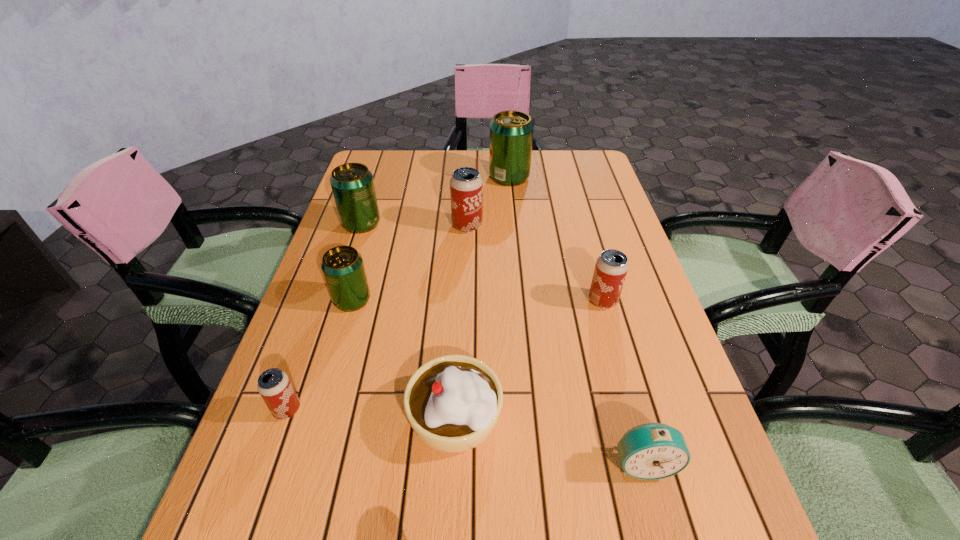
Where is `free space between the nearest green beer can and the beige whipped cream`? The width and height of the screenshot is (960, 540). free space between the nearest green beer can and the beige whipped cream is located at coordinates (403, 357).

I want to click on vacant space that is in between the nearest green beer can and the whipped cream, so click(403, 357).

You are a GUI agent. You are given a task and a screenshot of the screen. Output one action in this format:
    pyautogui.click(x=<x>, y=<y>)
    Task: Click on the free area in between the biggest red beer can and the second smallest green beer can
    Image resolution: width=960 pixels, height=540 pixels.
    Given the screenshot: What is the action you would take?
    pyautogui.click(x=414, y=225)

This screenshot has height=540, width=960. What are the coordinates of `vacant space that is in between the second nearest green beer can and the second biggest red beer can` in the screenshot? It's located at (482, 262).

Identify the location of the sixth closest object to the beige whipped cream. The height and width of the screenshot is (540, 960). coord(352,184).

Where is `the seventh closest object to the second red beer can from left to right`? The height and width of the screenshot is (540, 960). the seventh closest object to the second red beer can from left to right is located at coordinates (651, 451).

Where is `the fourth closest beer can relative to the farthest red beer can`? The image size is (960, 540). the fourth closest beer can relative to the farthest red beer can is located at coordinates click(x=611, y=267).

Find the location of `beer can identified as the third closest to the rightmost red beer can`. beer can identified as the third closest to the rightmost red beer can is located at coordinates click(x=342, y=266).

Select which green beer can appears as the second closest to the alarm clock. Please provide its 2D coordinates. Your answer should be formatted as a tuple, i.e. [(x, y)], where the tuple contains the x and y coordinates of a point satisfying the conditions above.

[(352, 184)]

Locate an element on the screen. green beer can identified as the closest to the second smallest green beer can is located at coordinates (342, 266).